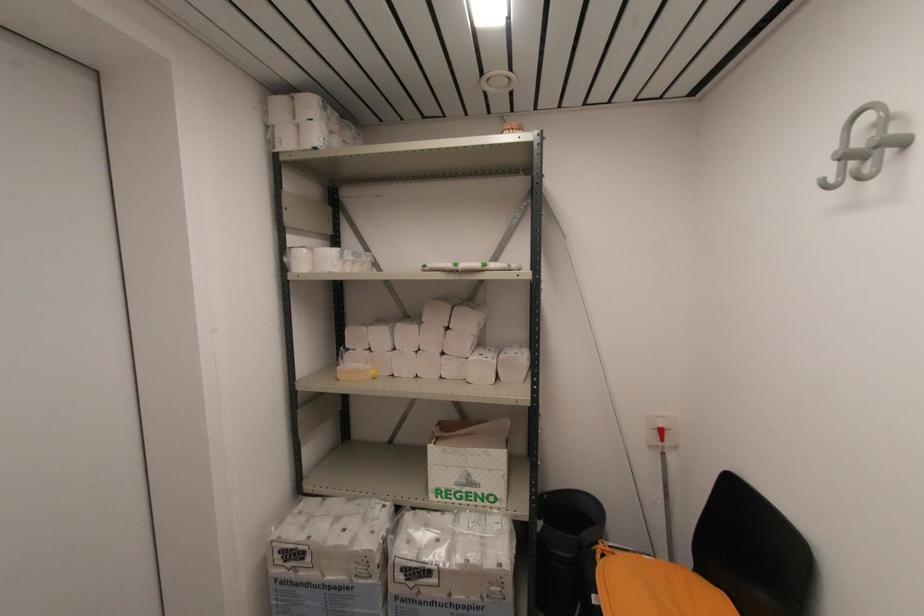
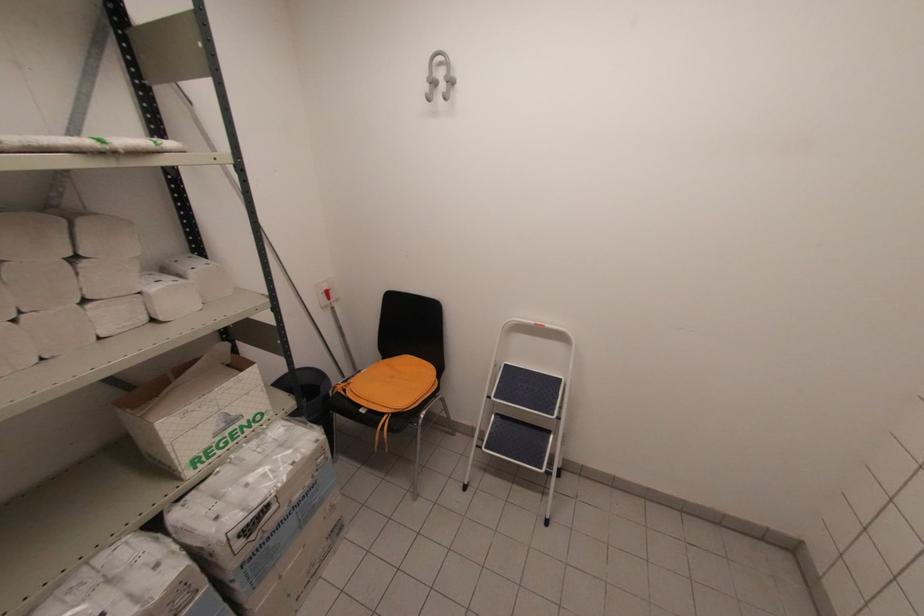
Question: I am providing you with two images of the same scene from different viewpoints. After the viewpoint changes to image2, which objects are now occluded?

Choices:
 (A) orange chair cushion
 (B) grey wall hook
 (C) open cardboard box
 (D) none of these

Answer: (D)